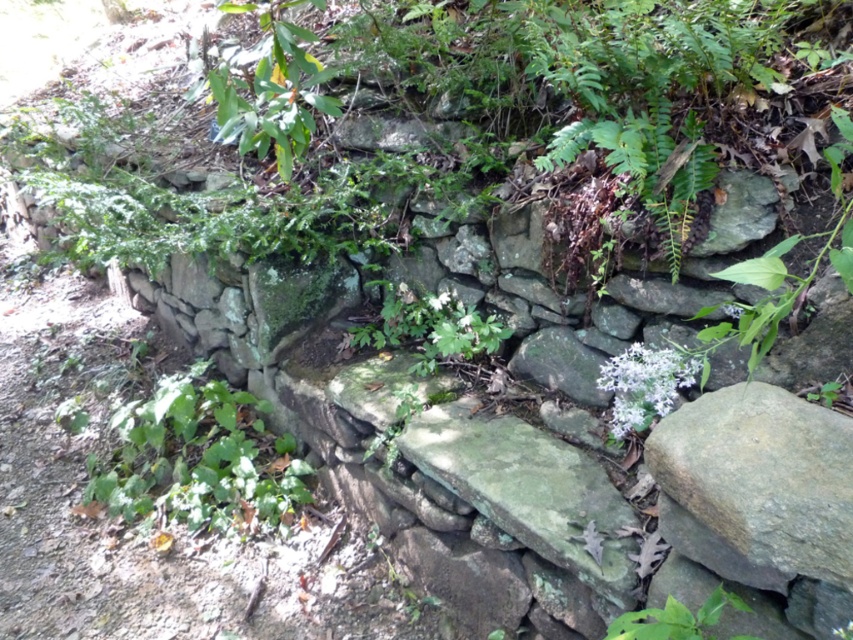
Question: Which of the following is the farthest from the observer?

Choices:
 (A) gray rough stone at lower right
 (B) white matte flower at center-right
 (C) green leafy plant at center

Answer: (C)

Question: Is gray rough stone at lower right wider than white matte flower at center-right?

Choices:
 (A) no
 (B) yes

Answer: (B)

Question: Which is farther from the green leafy plant at center?

Choices:
 (A) white matte flower at center-right
 (B) gray rough stone at lower right

Answer: (B)

Question: Is gray rough stone at lower right closer to camera compared to green leafy plant at center?

Choices:
 (A) yes
 (B) no

Answer: (A)

Question: Which object appears closest to the camera in this image?

Choices:
 (A) gray rough stone at lower right
 (B) green leafy plant at center

Answer: (A)

Question: Is gray rough stone at lower right positioned behind white matte flower at center-right?

Choices:
 (A) no
 (B) yes

Answer: (A)